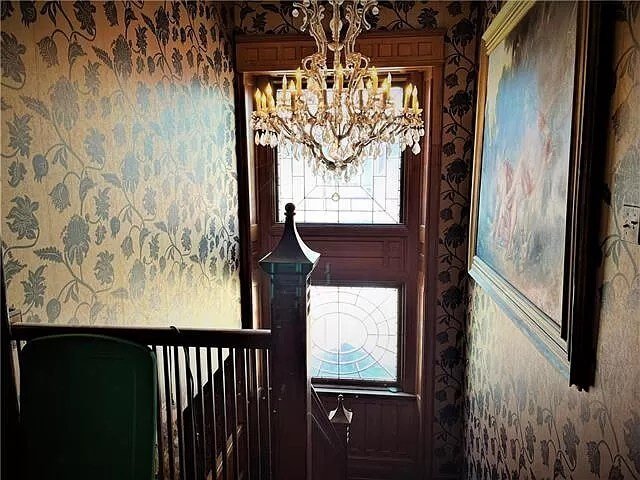
Identify the location of left wall. (184, 289).